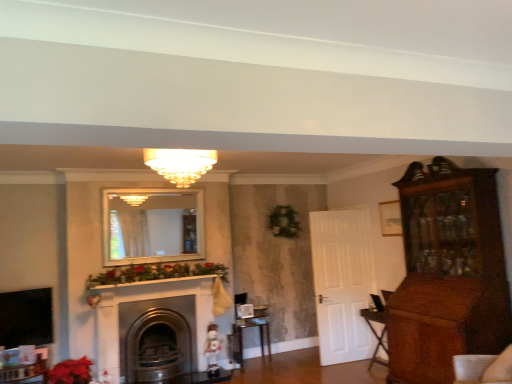
Question: Is matte glass chandelier at center outside vivid red petals at lower left?

Choices:
 (A) no
 (B) yes

Answer: (B)

Question: Considering the relative positions of matte glass chandelier at center and vivid red petals at lower left in the image provided, is matte glass chandelier at center behind vivid red petals at lower left?

Choices:
 (A) yes
 (B) no

Answer: (B)

Question: From the image's perspective, is matte glass chandelier at center located beneath vivid red petals at lower left?

Choices:
 (A) yes
 (B) no

Answer: (B)

Question: Is matte glass chandelier at center with vivid red petals at lower left?

Choices:
 (A) yes
 (B) no

Answer: (B)

Question: Is vivid red petals at lower left a part of matte glass chandelier at center?

Choices:
 (A) yes
 (B) no

Answer: (B)

Question: Is point (70, 360) closer or farther from the camera than point (125, 312)?

Choices:
 (A) farther
 (B) closer

Answer: (B)

Question: Is vivid red petals at lower left wider or thinner than metallic gold fireplace at center?

Choices:
 (A) wide
 (B) thin

Answer: (A)

Question: Based on their positions, is vivid red petals at lower left located to the left or right of metallic gold fireplace at center?

Choices:
 (A) left
 (B) right

Answer: (A)

Question: Would you say vivid red petals at lower left is inside or outside metallic gold fireplace at center?

Choices:
 (A) inside
 (B) outside

Answer: (B)

Question: From the image's perspective, is matte glass chandelier at center above or below metallic gold fireplace at center?

Choices:
 (A) above
 (B) below

Answer: (A)

Question: Visually, is matte glass chandelier at center positioned to the left or to the right of metallic gold fireplace at center?

Choices:
 (A) right
 (B) left

Answer: (A)

Question: Considering the positions of point (177, 148) and point (194, 357), is point (177, 148) closer or farther from the camera than point (194, 357)?

Choices:
 (A) farther
 (B) closer

Answer: (B)

Question: From a real-world perspective, relative to metallic gold fireplace at center, is matte glass chandelier at center vertically above or below?

Choices:
 (A) below
 (B) above

Answer: (B)

Question: Is matte glass chandelier at center spatially inside vivid red petals at lower left, or outside of it?

Choices:
 (A) inside
 (B) outside

Answer: (B)

Question: Is matte glass chandelier at center in front of or behind vivid red petals at lower left in the image?

Choices:
 (A) behind
 (B) front

Answer: (B)